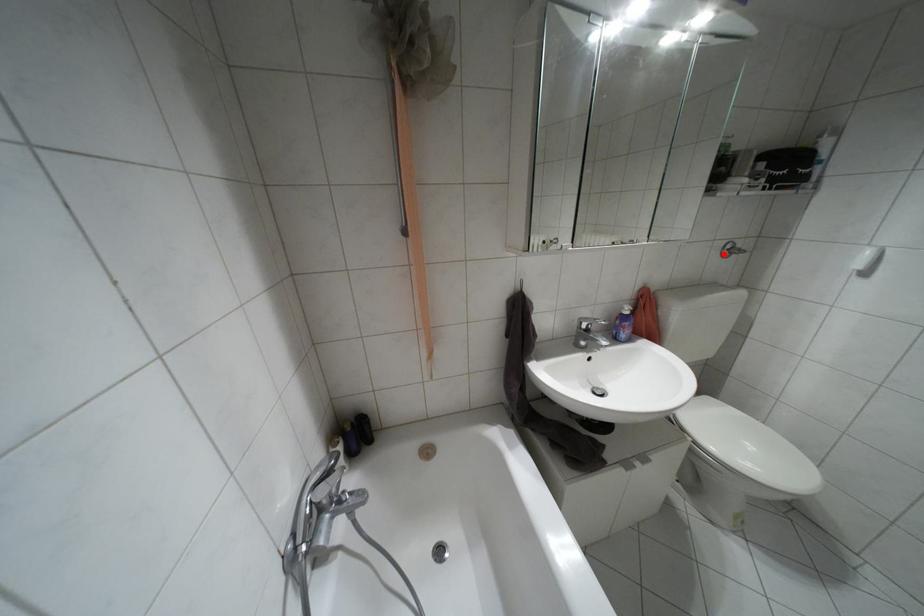
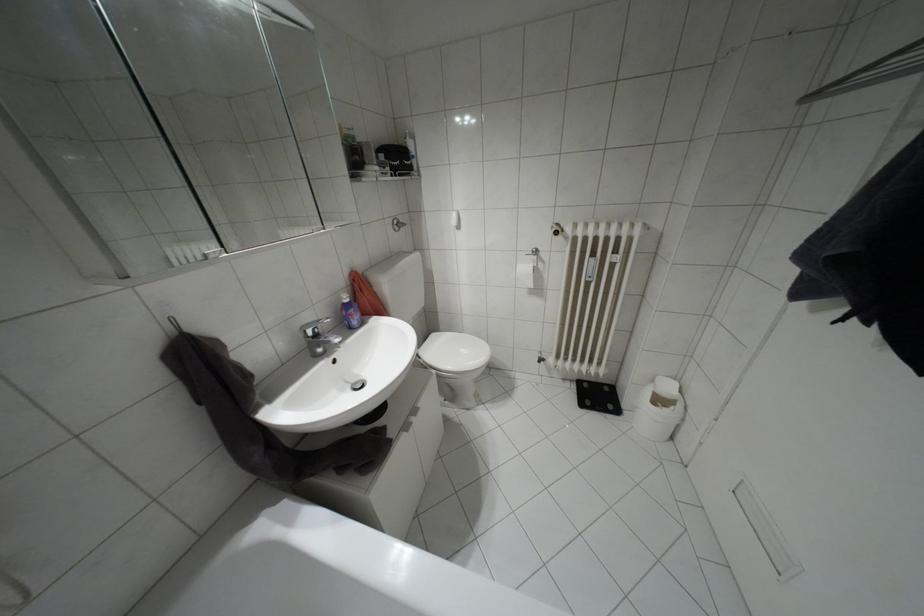
Question: I am providing you with two images of the same scene from different viewpoints. Image1 has a red point marked. In image2, the corresponding 3D location appears at what relative position? Reply with the corresponding letter.

Choices:
 (A) Closer
 (B) Farther

Answer: (A)